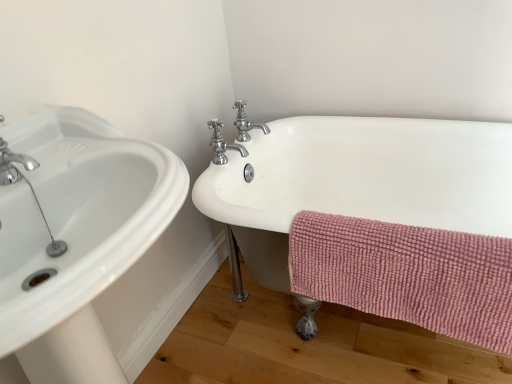
Question: Is the depth of white ceramic bathtub at right greater than that of chrome/metallic faucet at upper center, positioned as the second tap in front-to-back order?

Choices:
 (A) yes
 (B) no

Answer: (B)

Question: Is white ceramic bathtub at right not close to chrome/metallic faucet at upper center, acting as the first tap starting from the back?

Choices:
 (A) yes
 (B) no

Answer: (B)

Question: Can you confirm if white ceramic bathtub at right is positioned to the right of chrome/metallic faucet at upper center, acting as the first tap starting from the back?

Choices:
 (A) no
 (B) yes

Answer: (B)

Question: Considering the relative sizes of white ceramic bathtub at right and chrome/metallic faucet at upper center, acting as the first tap starting from the back, in the image provided, is white ceramic bathtub at right taller than chrome/metallic faucet at upper center, acting as the first tap starting from the back,?

Choices:
 (A) yes
 (B) no

Answer: (A)

Question: From a real-world perspective, is white ceramic bathtub at right positioned under chrome/metallic faucet at upper center, positioned as the second tap in front-to-back order, based on gravity?

Choices:
 (A) no
 (B) yes

Answer: (B)

Question: Which is correct: polished chrome faucet at upper center, the second tap when ordered from back to front, is inside white ceramic bathtub at right, or outside of it?

Choices:
 (A) outside
 (B) inside

Answer: (A)

Question: Is polished chrome faucet at upper center, the second tap when ordered from back to front, taller or shorter than white ceramic bathtub at right?

Choices:
 (A) tall
 (B) short

Answer: (B)

Question: From a real-world perspective, is polished chrome faucet at upper center, the second tap when ordered from back to front, positioned above or below white ceramic bathtub at right?

Choices:
 (A) above
 (B) below

Answer: (A)

Question: Does point (215, 158) appear closer or farther from the camera than point (465, 225)?

Choices:
 (A) closer
 (B) farther

Answer: (A)

Question: In the image, is white glossy sink at left positioned in front of or behind white ceramic bathtub at right?

Choices:
 (A) front
 (B) behind

Answer: (A)

Question: From a real-world perspective, is white glossy sink at left positioned above or below white ceramic bathtub at right?

Choices:
 (A) below
 (B) above

Answer: (B)

Question: From the image's perspective, relative to white ceramic bathtub at right, is white glossy sink at left above or below?

Choices:
 (A) above
 (B) below

Answer: (B)

Question: Is white glossy sink at left situated inside white ceramic bathtub at right or outside?

Choices:
 (A) inside
 (B) outside

Answer: (B)

Question: Is chrome/metallic faucet at upper center, acting as the first tap starting from the back, wider or thinner than white ceramic bathtub at right?

Choices:
 (A) thin
 (B) wide

Answer: (A)

Question: Considering the positions of point (237, 117) and point (476, 157), is point (237, 117) closer or farther from the camera than point (476, 157)?

Choices:
 (A) farther
 (B) closer

Answer: (A)